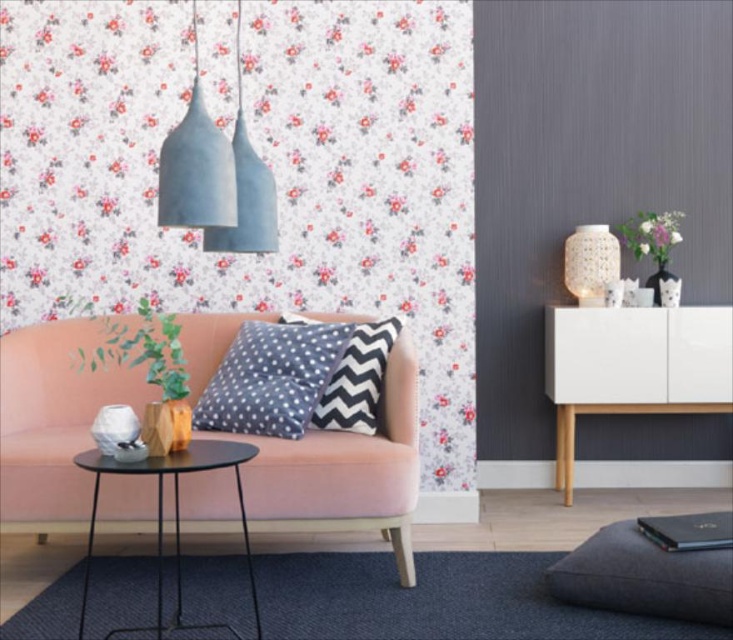
You are arranging a small table that is 10 inches wide between the velvet pink couch at center and the polka dot fabric pillow at center. Will the table fit without overlapping either object?

The velvet pink couch at center is 9.72 inches away from the polka dot fabric pillow at center. Since the table is 10 inches wide, it will not fit as the distance between them is slightly less than the table width. The table would overlap both objects.

You are standing in the living room and want to reach the matte concrete pendant light at upper center. If your maximum arm reach is 5 feet, can you touch it without using a stool?

The matte concrete pendant light at upper center is 5.35 feet away from the viewer, which is slightly beyond your maximum arm reach of 5 feet. Therefore, you would need a stool to touch it.